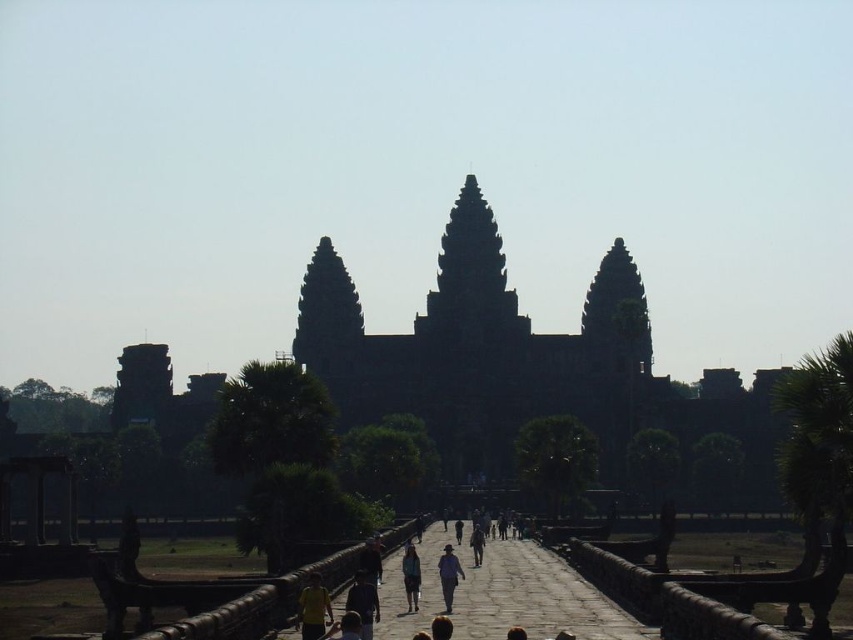
Question: Is dark brown hair at center above dark blue jeans at center?

Choices:
 (A) yes
 (B) no

Answer: (B)

Question: Which object is the closest to the yellow fabric person at lower center?

Choices:
 (A) blue fabric person at center
 (B) dark brown hair at center
 (C) brown stone path at center

Answer: (B)

Question: Which point appears closest to the camera in this image?

Choices:
 (A) (445, 556)
 (B) (473, 531)
 (C) (529, 609)
 (D) (410, 544)

Answer: (C)

Question: Among these objects, which one is nearest to the camera?

Choices:
 (A) dark blue jeans at center
 (B) yellow fabric person at lower center
 (C) dark brown hair at center

Answer: (C)

Question: Is yellow fabric person at lower center thinner than dark brown hair at center?

Choices:
 (A) yes
 (B) no

Answer: (A)

Question: Can you confirm if brown stone path at center is smaller than dark brown hair at center?

Choices:
 (A) no
 (B) yes

Answer: (A)